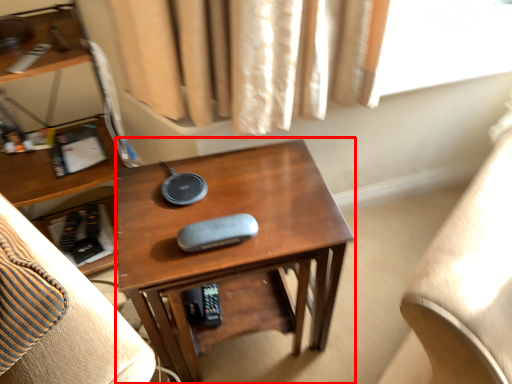
Question: Considering the relative positions of desk (annotated by the red box) and furniture in the image provided, where is desk (annotated by the red box) located with respect to the staircase?

Choices:
 (A) left
 (B) right

Answer: (B)